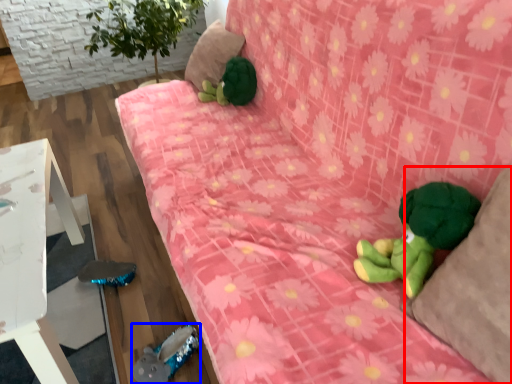
Question: Which object appears farthest to the camera in this image, pillow (highlighted by a red box) or toy (highlighted by a blue box)?

Choices:
 (A) pillow
 (B) toy

Answer: (B)